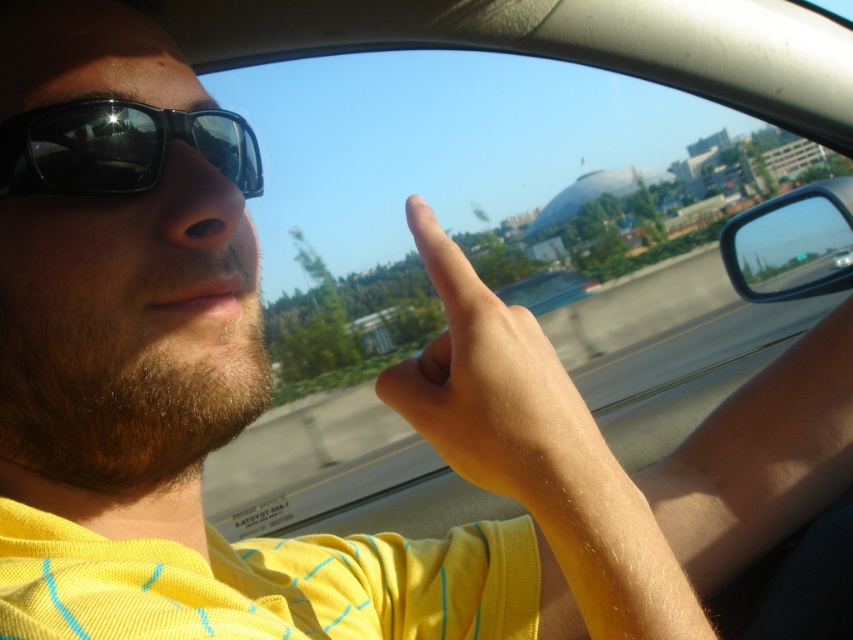
What do you see at coordinates (477, 252) in the screenshot? The width and height of the screenshot is (853, 640). I see `transparent glass window at center` at bounding box center [477, 252].

The height and width of the screenshot is (640, 853). Find the location of `transparent glass window at center`. transparent glass window at center is located at coordinates (477, 252).

Is point (457, 292) positioned behind point (39, 122)?

No, it is in front of (39, 122).

Is point (461, 352) farther from camera compared to point (105, 120)?

No.

What are the coordinates of `skinny yellow finger at upper center` in the screenshot? It's located at (494, 388).

Can you confirm if transparent glass window at center is positioned to the left of matte black sunglasses at upper left?

In fact, transparent glass window at center is to the right of matte black sunglasses at upper left.

Between point (621, 108) and point (132, 132), which one is positioned in front?

Positioned in front is point (132, 132).

Identify the location of transparent glass window at center. The width and height of the screenshot is (853, 640). (477, 252).